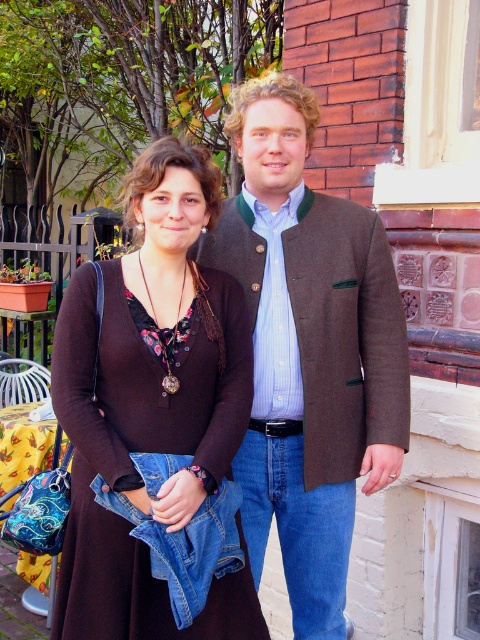
You are a photographer setting up a photo shoot. You have two items to place in the scene shown in the image. The items are the brown woolen jacket at center and the brown fabric dress at center. The client wants them to be exactly 15 inches apart. Based on the current placement, do you need to adjust their positions?

The brown woolen jacket at center is currently 14.57 inches from the brown fabric dress at center. Since the desired distance is 15 inches, you need to move them slightly apart by approximately 0.43 inches to meet the requirement.

You are trying to decide which clothing item to take from the two at the center. The brown woolen jacket at center is on top of the brown fabric dress at center. Which one is easier to grab quickly?

The brown woolen jacket at center is easier to grab quickly since it is positioned over the brown fabric dress at center, making it more accessible.

You are organizing a charity clothing drive and need to determine which item takes up more space in the donation box. Which item between the brown woolen jacket at center and the brown fabric dress at center occupies more space?

The brown woolen jacket at center has a larger size compared to the brown fabric dress at center, so it occupies more space.